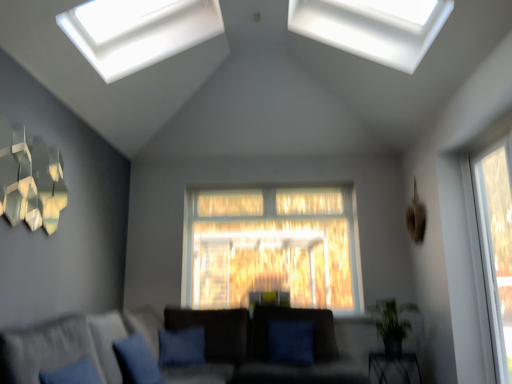
Question: Should I look upward or downward to see transparent glass window at right, the 1th window from the bottom?

Choices:
 (A) up
 (B) down

Answer: (B)

Question: Would you say green leafy plant at lower right is outside transparent glass window at upper center, the 3th window viewed from the right?

Choices:
 (A) yes
 (B) no

Answer: (A)

Question: From a real-world perspective, is green leafy plant at lower right physically below transparent glass window at upper center, the 2th window in the bottom-to-top sequence?

Choices:
 (A) no
 (B) yes

Answer: (B)

Question: Is green leafy plant at lower right oriented towards transparent glass window at upper center, which appears as the 2th window when viewed from the top?

Choices:
 (A) no
 (B) yes

Answer: (A)

Question: Is green leafy plant at lower right facing away from transparent glass window at upper center, the 3th window viewed from the right?

Choices:
 (A) no
 (B) yes

Answer: (A)

Question: From the image's perspective, does green leafy plant at lower right appear higher than transparent glass window at upper center, which appears as the 2th window when viewed from the top?

Choices:
 (A) yes
 (B) no

Answer: (B)

Question: Does green leafy plant at lower right have a greater height compared to transparent glass window at upper center, which appears as the 2th window when viewed from the top?

Choices:
 (A) yes
 (B) no

Answer: (B)

Question: Is blue fabric pillow at center behind green leafy plant at lower right?

Choices:
 (A) no
 (B) yes

Answer: (B)

Question: Is blue fabric pillow at center surrounding green leafy plant at lower right?

Choices:
 (A) yes
 (B) no

Answer: (B)

Question: Is blue fabric pillow at center directly adjacent to green leafy plant at lower right?

Choices:
 (A) no
 (B) yes

Answer: (A)

Question: Does blue fabric pillow at center have a lesser width compared to green leafy plant at lower right?

Choices:
 (A) no
 (B) yes

Answer: (B)

Question: Can you confirm if blue fabric pillow at center is smaller than green leafy plant at lower right?

Choices:
 (A) no
 (B) yes

Answer: (B)

Question: Is blue fabric pillow at center wider than green leafy plant at lower right?

Choices:
 (A) no
 (B) yes

Answer: (A)

Question: Is metallic geometric art at upper left taller than blue fabric pillow at lower center?

Choices:
 (A) no
 (B) yes

Answer: (B)